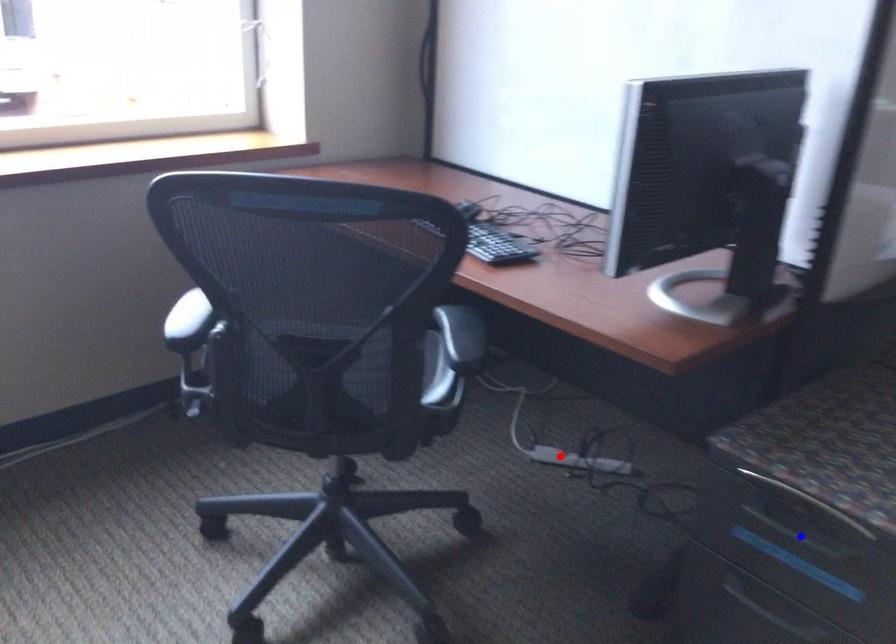
Question: Which of the two points in the image is closer to the camera?

Choices:
 (A) Blue point is closer.
 (B) Red point is closer.

Answer: (A)